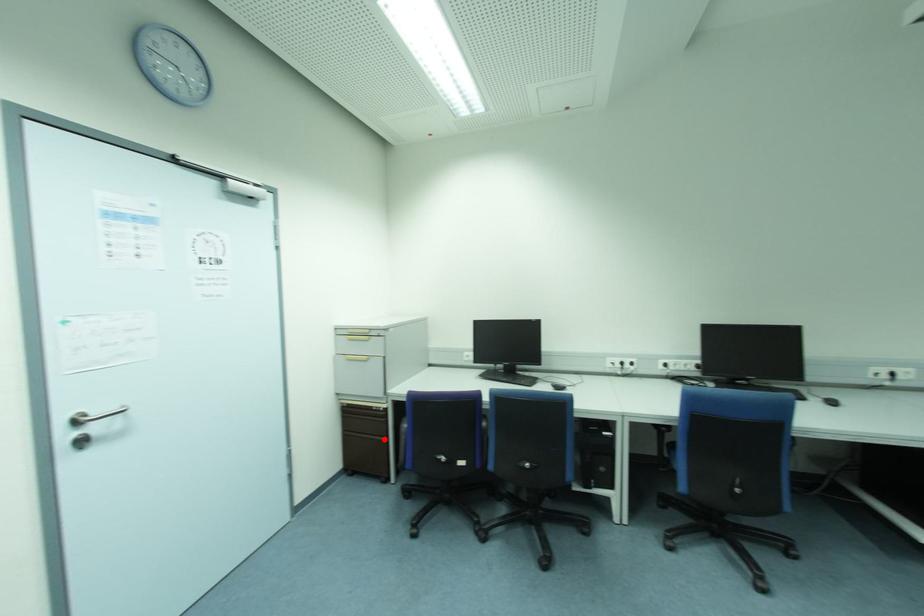
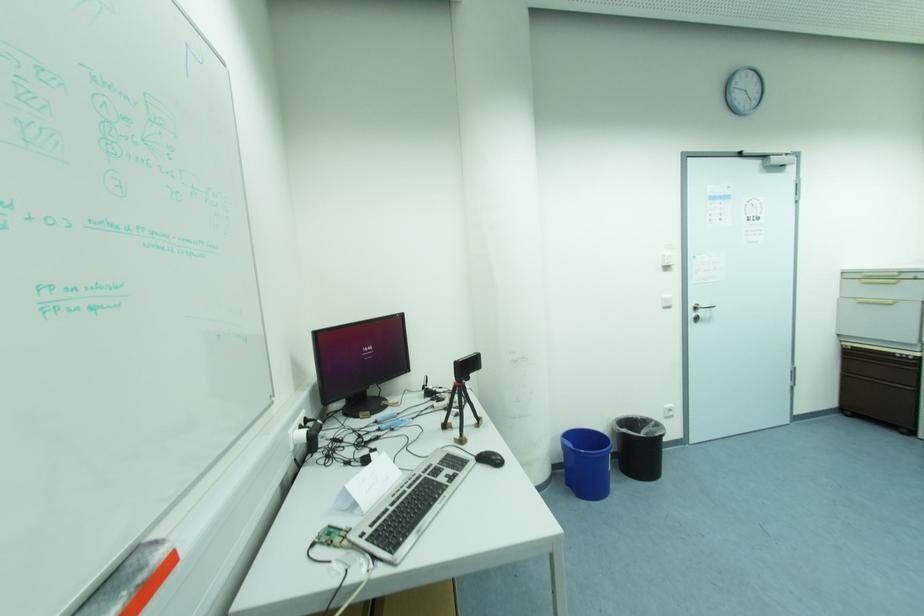
Question: I am providing you with two images of the same scene from different viewpoints. In image1, a red point is highlighted. Considering the same 3D point in image2, which of the following is correct?

Choices:
 (A) It is closer
 (B) It is farther

Answer: (A)